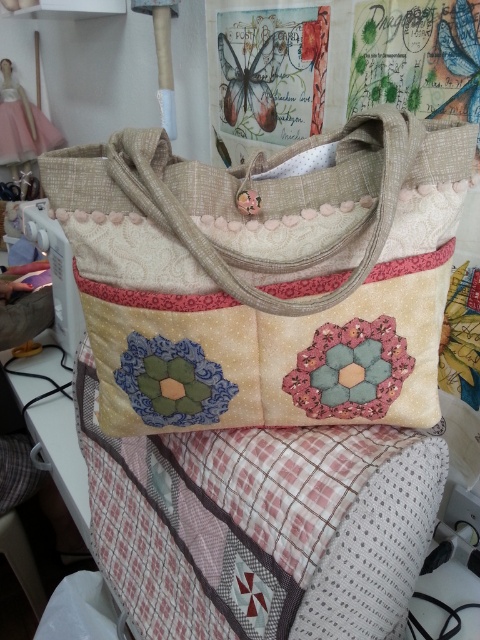
Question: Which point appears closest to the camera in this image?

Choices:
 (A) (107, 468)
 (B) (41, 164)

Answer: (B)

Question: Is patchwork fabric quilt at center positioned in front of textured beige shoulder bag at center?

Choices:
 (A) yes
 (B) no

Answer: (B)

Question: Does patchwork fabric quilt at center appear under textured beige shoulder bag at center?

Choices:
 (A) yes
 (B) no

Answer: (A)

Question: Is patchwork fabric quilt at center above textured beige shoulder bag at center?

Choices:
 (A) yes
 (B) no

Answer: (B)